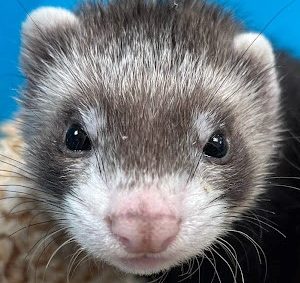
Find the location of a particular element. The width and height of the screenshot is (300, 283). wall is located at coordinates (12, 60).